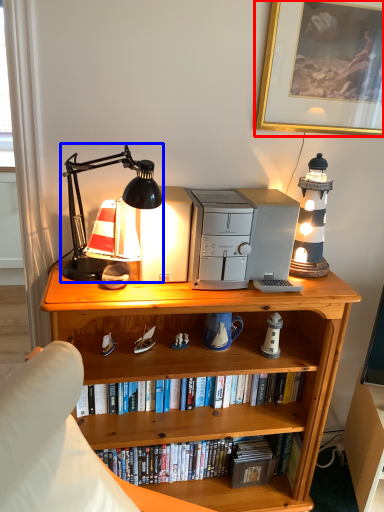
Question: Which point is further to the camera, picture frame (highlighted by a red box) or lamp (highlighted by a blue box)?

Choices:
 (A) picture frame
 (B) lamp

Answer: (A)